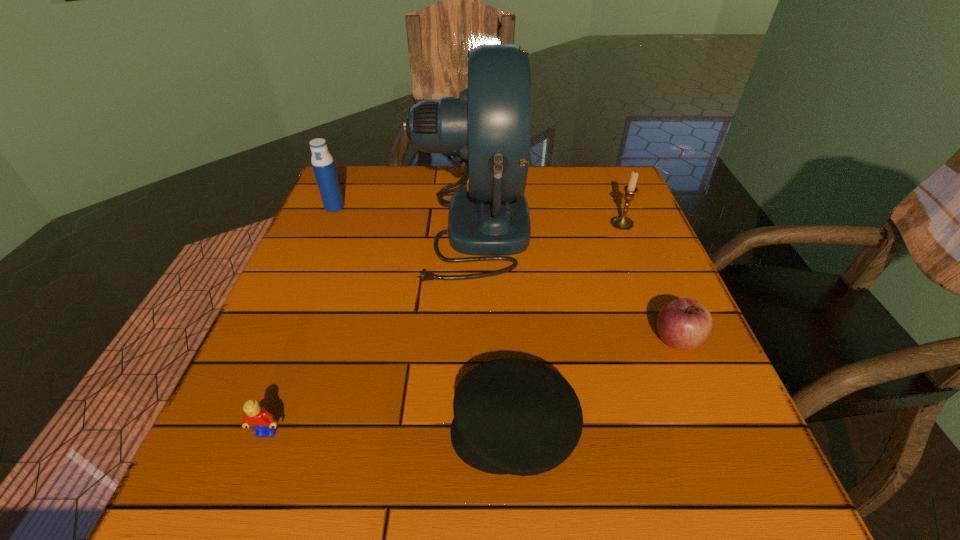
At what (x,y) coordinates should I click in order to perform the action: click on candle holder at the right edge. Please return your answer as a coordinate pair (x, y). The image size is (960, 540). Looking at the image, I should click on (621, 222).

Locate an element on the screen. Image resolution: width=960 pixels, height=540 pixels. apple located at the right edge is located at coordinates (684, 324).

Image resolution: width=960 pixels, height=540 pixels. Find the location of `object that is at the far left corner`. object that is at the far left corner is located at coordinates (322, 161).

Where is `free region at the far edge of the desktop`? The width and height of the screenshot is (960, 540). free region at the far edge of the desktop is located at coordinates (558, 184).

You are a GUI agent. You are given a task and a screenshot of the screen. Output one action in this format:
    pyautogui.click(x=<x>, y=<y>)
    Task: Click on the vacant space at the near edge of the desktop
    The image size is (960, 540).
    Given the screenshot: What is the action you would take?
    (449, 483)

The height and width of the screenshot is (540, 960). In the image, there is a desktop. Find the location of `free space at the left edge`. free space at the left edge is located at coordinates (324, 396).

This screenshot has height=540, width=960. In order to click on vacant region at the right edge of the desktop in this screenshot , I will do `click(652, 257)`.

The width and height of the screenshot is (960, 540). In the image, there is a desktop. Find the location of `free region at the far left corner`. free region at the far left corner is located at coordinates (358, 194).

Identify the location of free space at the far right corner of the desktop. This screenshot has height=540, width=960. (582, 210).

Locate an element on the screen. The height and width of the screenshot is (540, 960). free area in between the beret and the Lego is located at coordinates [x=391, y=431].